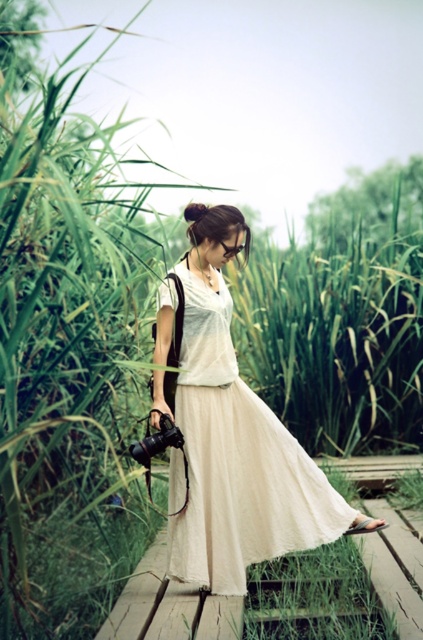
Can you confirm if light beige cotton dress at center is positioned below black matte camera at lower left?

No, light beige cotton dress at center is not below black matte camera at lower left.

Does light beige cotton dress at center have a lesser width compared to black matte camera at lower left?

No, light beige cotton dress at center is not thinner than black matte camera at lower left.

Between point (274, 524) and point (173, 438), which one is positioned in front?

Positioned in front is point (173, 438).

At what (x,y) coordinates should I click in order to perform the action: click on light beige cotton dress at center. Please return your answer as a coordinate pair (x, y). The height and width of the screenshot is (640, 423). Looking at the image, I should click on (238, 461).